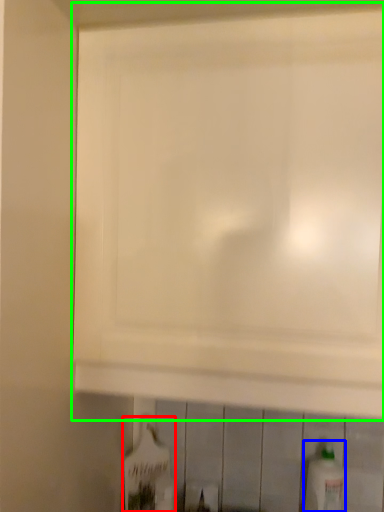
Question: Which object is the farthest from bottle (highlighted by a red box)? Choose among these: bottle (highlighted by a blue box) or cabinetry (highlighted by a green box).

Choices:
 (A) bottle
 (B) cabinetry

Answer: (B)